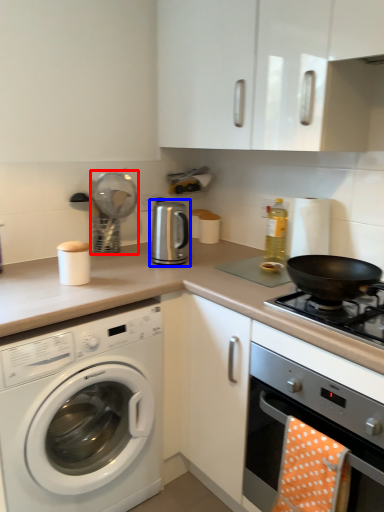
Question: Which object appears farthest to the camera in this image, appliance (highlighted by a red box) or appliance (highlighted by a blue box)?

Choices:
 (A) appliance
 (B) appliance

Answer: (A)